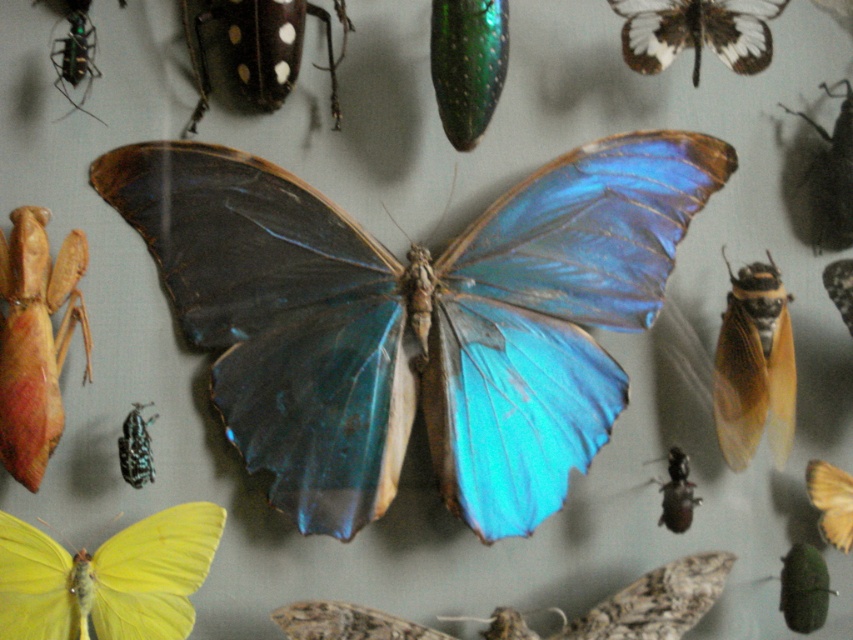
Does shiny brown beetle at upper center appear over green shiny beetle at lower right?

Yes, shiny brown beetle at upper center is above green shiny beetle at lower right.

Where is `shiny brown beetle at upper center`? This screenshot has width=853, height=640. shiny brown beetle at upper center is located at coordinates (253, 51).

Consider the image. Who is more distant from viewer, (788,554) or (683,483)?

The point (788,554) is behind.

Is green shiny beetle at lower right behind shiny black beetle at lower right?

Yes, green shiny beetle at lower right is further from the viewer.

Describe the element at coordinates (804, 588) in the screenshot. I see `green shiny beetle at lower right` at that location.

Where is `green shiny beetle at lower right`? The height and width of the screenshot is (640, 853). green shiny beetle at lower right is located at coordinates (804, 588).

Does green metallic beetle at upper center appear on the right side of shiny metallic butterfly at center?

No, green metallic beetle at upper center is not to the right of shiny metallic butterfly at center.

Does green metallic beetle at upper center lie in front of shiny metallic butterfly at center?

Yes, it is in front of shiny metallic butterfly at center.

Based on the photo, who is more distant from viewer, (438, 77) or (827, 268)?

Point (827, 268)

Where is `green metallic beetle at upper center`? green metallic beetle at upper center is located at coordinates (467, 65).